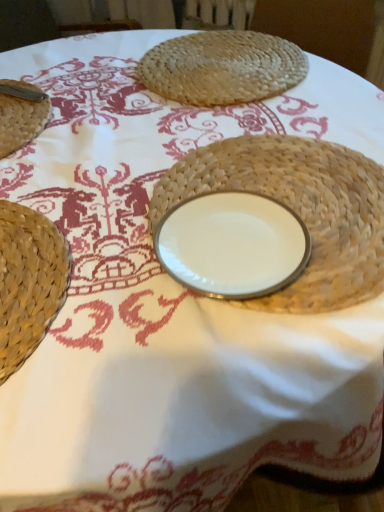
You are a GUI agent. You are given a task and a screenshot of the screen. Output one action in this format:
    pyautogui.click(x=<x>, y=<y>)
    Task: Click on the empty space that is ontop of white porcelain plate at center (from a real-world perspective)
    The image size is (384, 512).
    Given the screenshot: What is the action you would take?
    pyautogui.click(x=235, y=238)